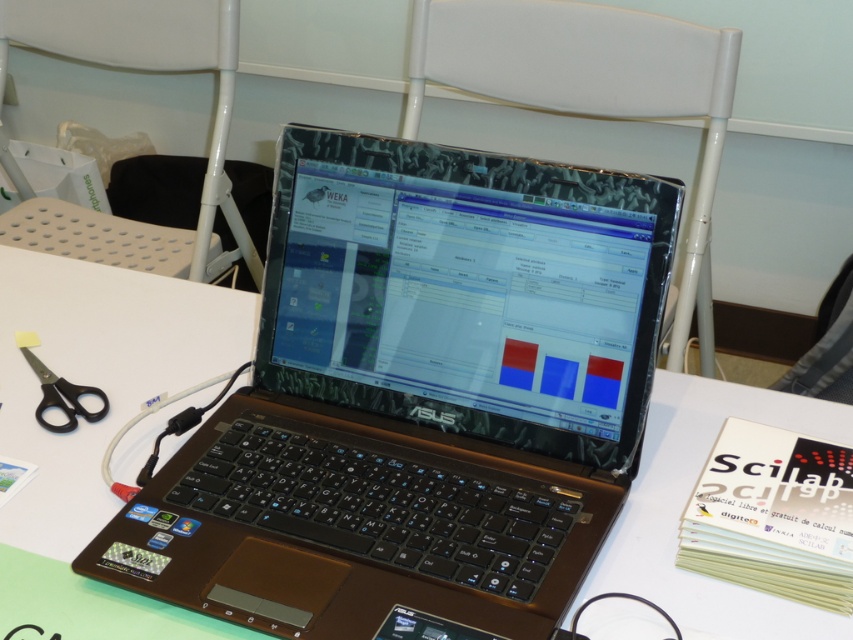
Can you confirm if white plastic chair at upper center is wider than black plastic scissors at lower left?

Correct, the width of white plastic chair at upper center exceeds that of black plastic scissors at lower left.

Is point (128, 13) farther from camera compared to point (77, 396)?

Yes.

Locate an element on the screen. This screenshot has height=640, width=853. white plastic chair at upper center is located at coordinates (151, 70).

Does white fabric chair at center appear on the left side of white plastic chair at upper center?

Incorrect, white fabric chair at center is not on the left side of white plastic chair at upper center.

Which of these two, white fabric chair at center or white plastic chair at upper center, stands shorter?

With less height is white plastic chair at upper center.

Where is `white fabric chair at center`? white fabric chair at center is located at coordinates (590, 90).

Who is positioned more to the left, brown matte laptop at center or black plastic scissors at lower left?

black plastic scissors at lower left is more to the left.

Is brown matte laptop at center taller than black plastic scissors at lower left?

Yes.

Is point (575, 179) positioned behind point (26, 355)?

No, it is in front of (26, 355).

At what (x,y) coordinates should I click in order to perform the action: click on brown matte laptop at center. Please return your answer as a coordinate pair (x, y). Looking at the image, I should click on (416, 397).